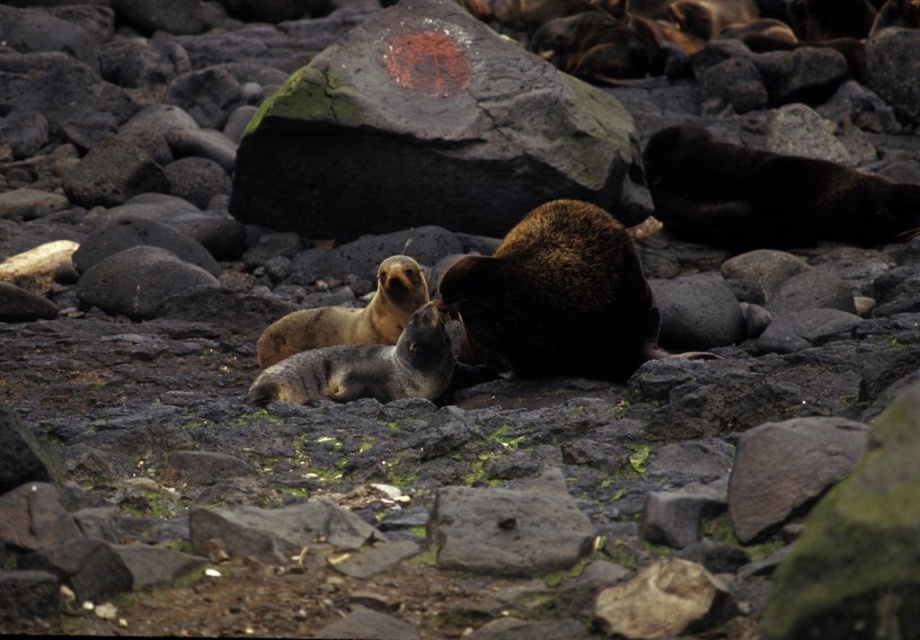
Looking at the scene with the brown fuzzy seal at center and the brown fuzzy seal at upper right, which seal is positioned more to the right side of the image?

The brown fuzzy seal at upper right is positioned more to the right side of the image compared to the brown fuzzy seal at center.

Based on the photo, you are a photographer trying to capture a closeup of the golden fur seal at center. You notice there is a dark gray textured rock at center in the way. Can you move the rock to get a better shot?

The dark gray textured rock at center is larger in size than golden fur seal at center, so it might be difficult to move it easily. You might need to find an alternative angle or wait for the seal to move.

In the scene with the brown fuzzy seal at center and the brown fuzzy seal at upper right, which seal is smaller?

The brown fuzzy seal at center is smaller compared to the brown fuzzy seal at upper right.